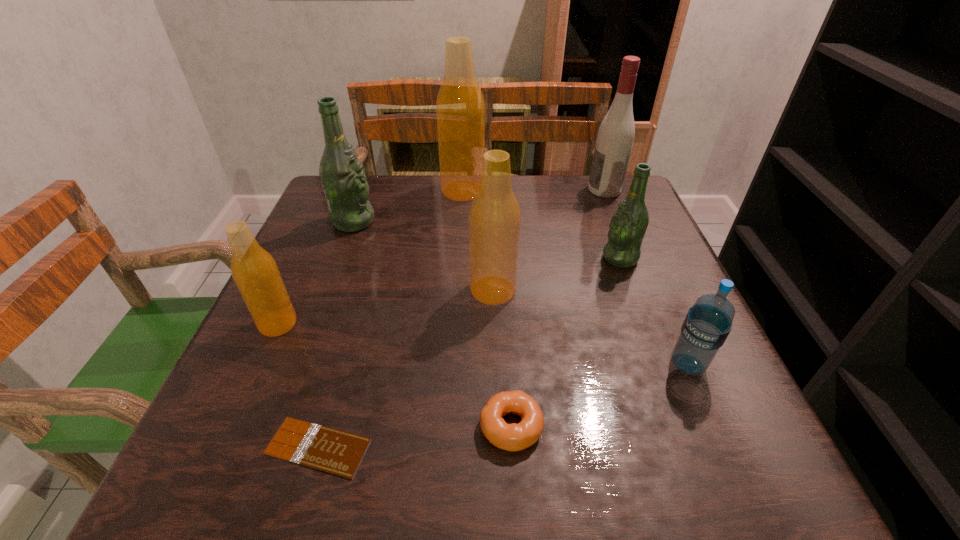
Locate an element on the screen. Image resolution: width=960 pixels, height=540 pixels. blank area in the image that satisfies the following two spatial constraints: 1. on the back side of the water bottle; 2. on the right side of the second shortest object is located at coordinates (508, 364).

You are a GUI agent. You are given a task and a screenshot of the screen. Output one action in this format:
    pyautogui.click(x=<x>, y=<y>)
    Task: Click on the free spot that satisfies the following two spatial constraints: 1. on the label of the alcohol; 2. on the right side of the water bottle
    Image resolution: width=960 pixels, height=540 pixels.
    Given the screenshot: What is the action you would take?
    pyautogui.click(x=674, y=364)

Identify the location of free location that satisfies the following two spatial constraints: 1. on the back side of the blue water bottle; 2. on the surface of the right green beer bottle. (642, 258).